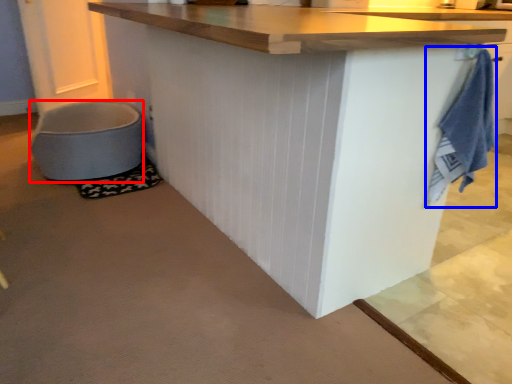
Question: Among these objects, which one is nearest to the camera, toilet bowl (highlighted by a red box) or bath towel (highlighted by a blue box)?

Choices:
 (A) toilet bowl
 (B) bath towel

Answer: (B)